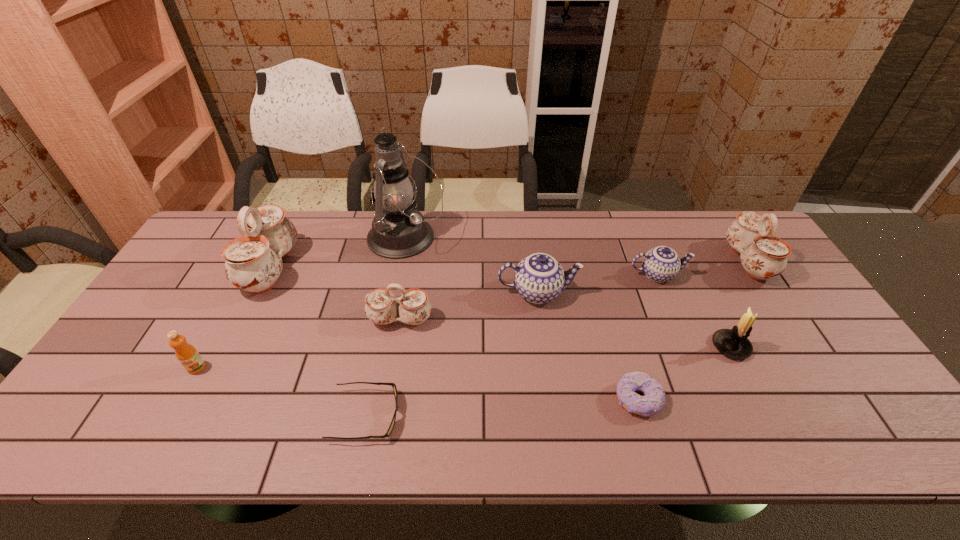
Identify which chinaware is located as the third nearest to the right blue chinaware. Please provide its 2D coordinates. Your answer should be formatted as a tuple, i.e. [(x, y)], where the tuple contains the x and y coordinates of a point satisfying the conditions above.

[(381, 308)]

Where is `the closest white chinaware to the second biggest white chinaware`? the closest white chinaware to the second biggest white chinaware is located at coordinates (381, 308).

What are the coordinates of `white chinaware that is the second closest to the rightmost white chinaware` in the screenshot? It's located at (253, 262).

The image size is (960, 540). I want to click on free space that satisfies the following two spatial constraints: 1. on the back side of the candle holder; 2. by the handle of the tallest chinaware, so click(691, 268).

This screenshot has width=960, height=540. I want to click on free location that satisfies the following two spatial constraints: 1. on the back side of the fourth object from right to left; 2. at the spout of the left blue chinaware, so click(x=607, y=293).

Identify the location of vacant region that satisfies the following two spatial constraints: 1. on the front side of the tallest object; 2. by the handle of the leftmost white chinaware. This screenshot has height=540, width=960. (400, 268).

This screenshot has width=960, height=540. Identify the location of vacant point that satisfies the following two spatial constraints: 1. by the handle of the second tallest chinaware; 2. by the handle of the smallest white chinaware. (785, 320).

I want to click on free spot that satisfies the following two spatial constraints: 1. at the spout of the bigger blue chinaware; 2. by the handle of the second chinaware from left to right, so click(x=541, y=320).